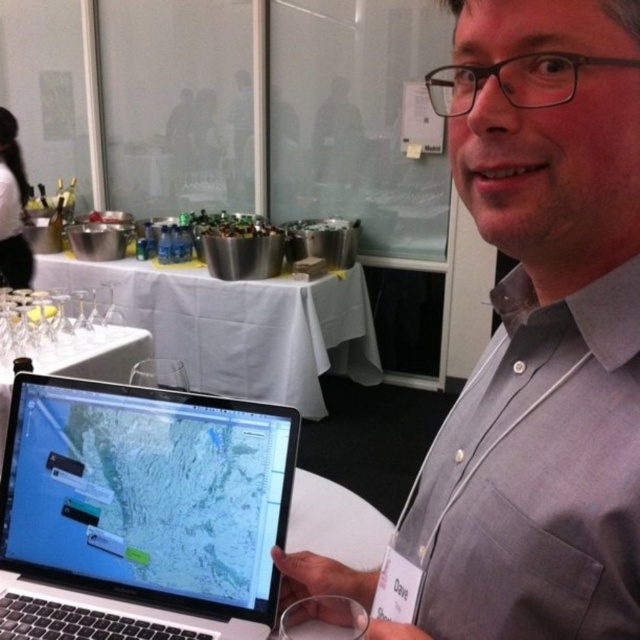
Question: Does satin black laptop at lower left have a larger size compared to white cloth table at center?

Choices:
 (A) yes
 (B) no

Answer: (B)

Question: Which is nearer to the gray cotton shirt at center?

Choices:
 (A) satin black laptop at lower left
 (B) white cloth table at center

Answer: (A)

Question: Is satin black laptop at lower left further to camera compared to white cloth table at center?

Choices:
 (A) no
 (B) yes

Answer: (A)

Question: Estimate the real-world distances between objects in this image. Which object is closer to the satin black laptop at lower left?

Choices:
 (A) gray cotton shirt at center
 (B) white cloth table at center

Answer: (A)

Question: Can you confirm if gray cotton shirt at center is wider than satin black laptop at lower left?

Choices:
 (A) no
 (B) yes

Answer: (A)

Question: Which of the following is the closest to the observer?

Choices:
 (A) (76, 490)
 (B) (372, 365)

Answer: (A)